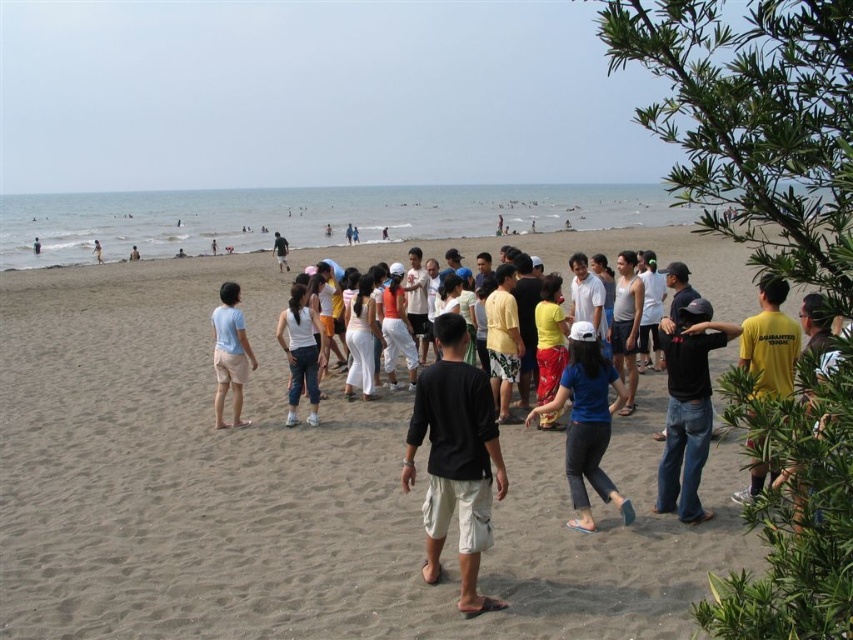
Question: Does blue fabric shirt at center lie behind light blue fabric at center?

Choices:
 (A) no
 (B) yes

Answer: (A)

Question: Estimate the real-world distances between objects in this image. Which object is closer to the blue fabric shirt at center?

Choices:
 (A) black cotton shirt at center
 (B) light blue jeans at center
 (C) brown sandy beach at center

Answer: (A)

Question: Can you confirm if black cotton shirt at center is bigger than light blue fabric at center?

Choices:
 (A) no
 (B) yes

Answer: (B)

Question: Which point appears farthest from the camera in this image?

Choices:
 (A) (235, 416)
 (B) (93, 241)
 (C) (424, 508)

Answer: (B)

Question: In this image, where is black matte shirt at center located relative to matte black shirt at center?

Choices:
 (A) above
 (B) below

Answer: (B)

Question: Which point appears farthest from the camera in this image?

Choices:
 (A) (276, 237)
 (B) (685, 497)
 (C) (213, 353)
 (D) (770, 371)

Answer: (A)